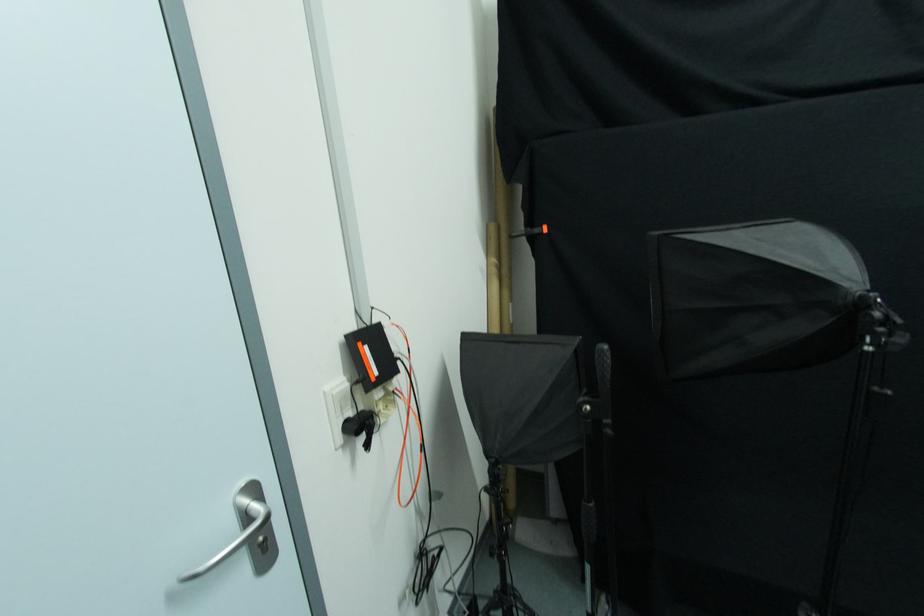
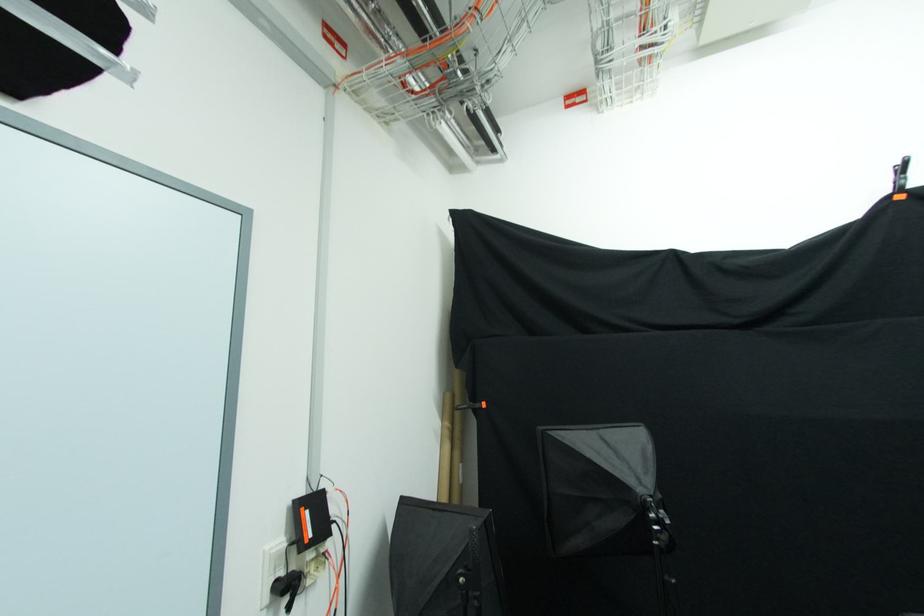
In the second image, find the point that corresponds to pixel 353 416 in the first image.

(285, 577)